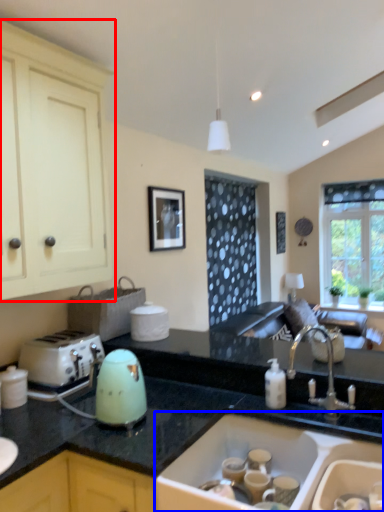
Question: Which object is further to the camera taking this photo, cabinetry (highlighted by a red box) or sink (highlighted by a blue box)?

Choices:
 (A) cabinetry
 (B) sink

Answer: (A)